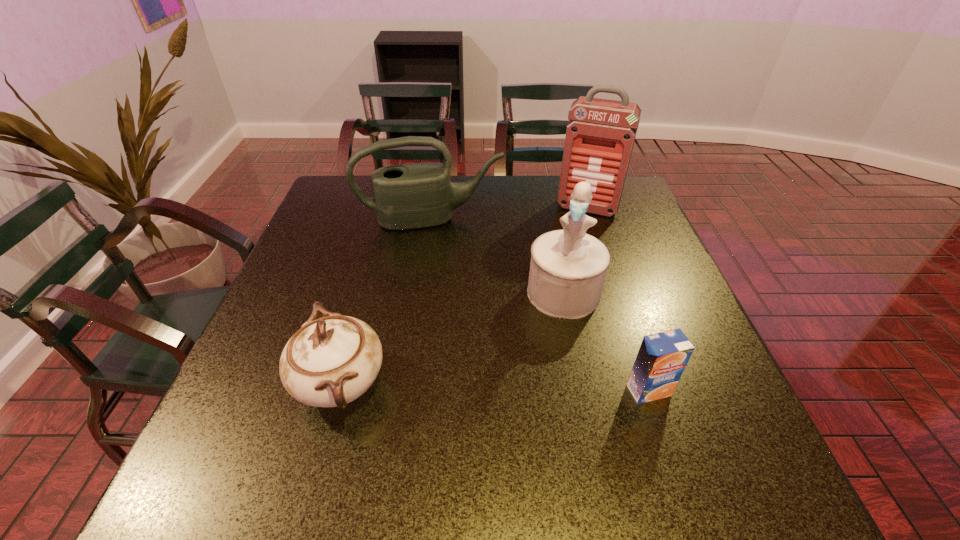
You are a GUI agent. You are given a task and a screenshot of the screen. Output one action in this format:
    pyautogui.click(x=<x>, y=<y>)
    Task: Click on the vacant space located 0.360m on the spout of the watering can
    
    Given the screenshot: What is the action you would take?
    pyautogui.click(x=464, y=326)

You are a GUI agent. You are given a task and a screenshot of the screen. Output one action in this format:
    pyautogui.click(x=<x>, y=<y>)
    Task: Click on the free region located on the front-facing side of the tallest object
    
    Given the screenshot: What is the action you would take?
    (562, 274)

Identify the location of vacant space located on the front-facing side of the tallest object. The height and width of the screenshot is (540, 960). (577, 228).

Find the location of a particular element. The width and height of the screenshot is (960, 540). free location located on the front-facing side of the tallest object is located at coordinates (573, 240).

Identify the location of free space located at the beak of the fourth shortest object. (530, 402).

At what (x,y) coordinates should I click in order to perform the action: click on vacant space situated 0.180m at the beak of the fourth shortest object. Please return your answer as a coordinate pair (x, y). Image resolution: width=960 pixels, height=540 pixels. Looking at the image, I should click on (536, 381).

Image resolution: width=960 pixels, height=540 pixels. Find the location of `vacant area situated 0.050m at the beak of the fourth shortest object`. vacant area situated 0.050m at the beak of the fourth shortest object is located at coordinates coord(551,334).

Locate an element on the screen. The height and width of the screenshot is (540, 960). watering can situated at the far edge is located at coordinates (417, 195).

At what (x,y) coordinates should I click in order to perform the action: click on the first-aid kit that is positioned at the far edge. Please return your answer as a coordinate pair (x, y). The width and height of the screenshot is (960, 540). Looking at the image, I should click on (600, 135).

Image resolution: width=960 pixels, height=540 pixels. I want to click on chinaware that is positioned at the near edge, so click(x=329, y=362).